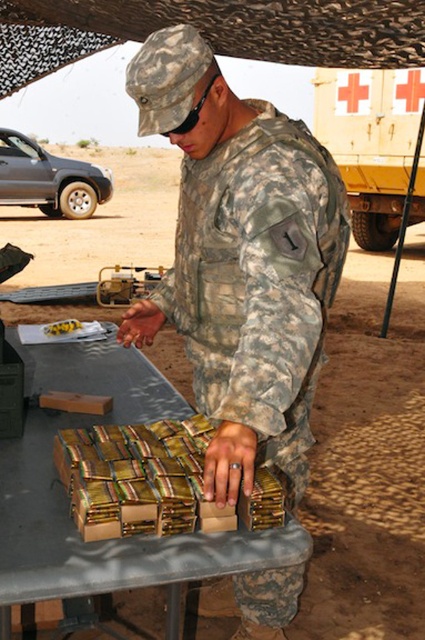
Based on the photo, you are a military supply inspector checking the storage area. You notice the camouflage uniform at center and the brown cardboard boxes at center. Which object is wider?

The brown cardboard boxes at center are wider than the camouflage uniform at center.

Consider the image. You are a military inspector checking the desert training site. You notice the camouflage uniform at center and the brown cardboard boxes at center. Which object is closer to you from your vantage point?

The camouflage uniform at center is closer to you because the brown cardboard boxes at center are positioned behind it.

You are a soldier in a desert environment. You need to place a 12 inch long tool between your camouflage uniform at center and the brown cardboard boxes at center. Can you fit it there?

The camouflage uniform at center and brown cardboard boxes at center are 15.43 inches apart from each other. Since the tool is 12 inches long, it can fit between them as the distance is greater than the tool length.